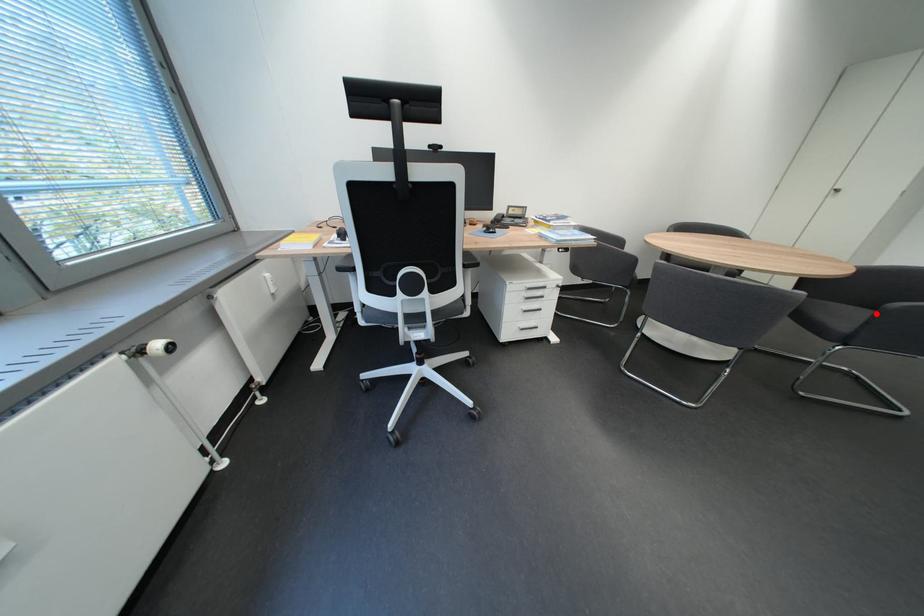
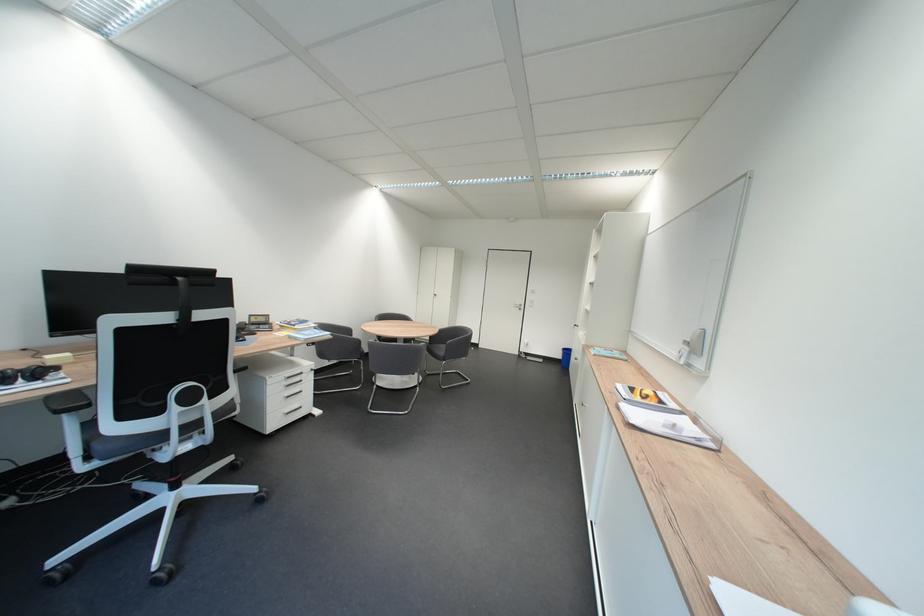
In the second image, find the point that corresponds to the highlighted location in the first image.

(456, 347)